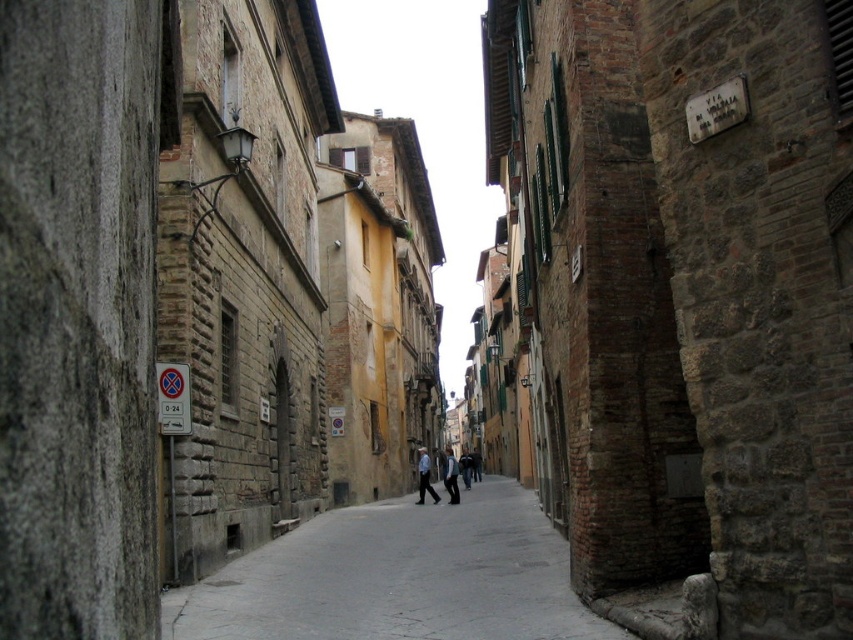
Is smooth concrete pavement at center to the left of blue denim jeans at center from the viewer's perspective?

Incorrect, smooth concrete pavement at center is not on the left side of blue denim jeans at center.

Describe the element at coordinates (397, 577) in the screenshot. This screenshot has height=640, width=853. I see `smooth concrete pavement at center` at that location.

Find the location of a particular element. smooth concrete pavement at center is located at coordinates (397, 577).

Which is below, blue denim jeans at center or light blue denim jacket at center?

light blue denim jacket at center is lower down.

Can you confirm if blue denim jeans at center is positioned above light blue denim jacket at center?

Yes.

Measure the distance between point (x=422, y=474) and camera.

91.73 feet

This screenshot has height=640, width=853. What are the coordinates of `blue denim jeans at center` in the screenshot? It's located at (424, 477).

Is point (537, 560) closer to viewer compared to point (457, 500)?

That is True.

Which is more to the left, smooth concrete pavement at center or light blue denim jacket at center?

smooth concrete pavement at center is more to the left.

Who is more distant from viewer, (428,627) or (457,470)?

Positioned behind is point (457,470).

Find the location of a particular element. smooth concrete pavement at center is located at coordinates (397, 577).